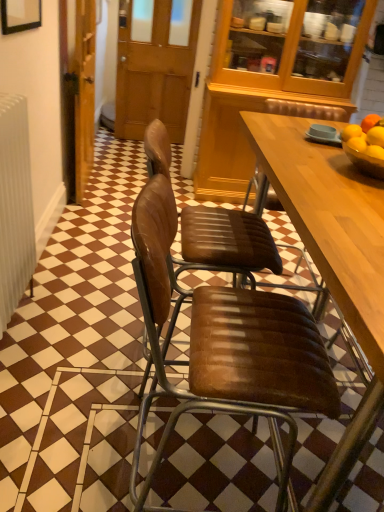
The width and height of the screenshot is (384, 512). Describe the element at coordinates (154, 75) in the screenshot. I see `brown wooden door at center` at that location.

This screenshot has height=512, width=384. What do you see at coordinates (228, 347) in the screenshot?
I see `brown leather chair at center, the 1th chair positioned from the bottom` at bounding box center [228, 347].

Consider the image. In order to face wooden door at left, should I rotate leftwards or rightwards?

Turn left by 14.219 degrees to look at wooden door at left.

This screenshot has width=384, height=512. I want to click on yellow matte/orange matte/orange bowl at right, so tap(366, 136).

Which chair is the 2nd one when counting from the right side of the brown wooden door at center? Please provide its 2D coordinates.

[(232, 246)]

Which is behind, brown leather chair at center, arranged as the 2th chair when ordered from the bottom, or brown wooden door at center?

brown wooden door at center is behind.

From the image's perspective, is brown leather chair at center, arranged as the 2th chair when ordered from the bottom, on top of brown wooden door at center?

Incorrect, from the image's perspective, brown leather chair at center, arranged as the 2th chair when ordered from the bottom, is lower than brown wooden door at center.

In terms of size, does brown leather chair at center, positioned as the second chair in top-to-bottom order, appear bigger or smaller than brown wooden door at center?

Considering their sizes, brown leather chair at center, positioned as the second chair in top-to-bottom order, takes up more space than brown wooden door at center.

Does brown leather chair at center, positioned as the second chair in top-to-bottom order, appear on the left side of brown wooden door at center?

No.

Consider the image. Would you say brown leather chair at center, the 1th chair positioned from the bottom, is inside or outside brown wooden door at center?

brown leather chair at center, the 1th chair positioned from the bottom, is outside brown wooden door at center.

Which object is wider, brown leather chair at center, the first chair when ordered from top to bottom, or brown leather chair at center, positioned as the second chair in top-to-bottom order?

With larger width is brown leather chair at center, the first chair when ordered from top to bottom.

From the image's perspective, is brown leather chair at center, the first chair when ordered from top to bottom, over brown leather chair at center, the 1th chair positioned from the bottom?

Yes, from the image's perspective, brown leather chair at center, the first chair when ordered from top to bottom, is above brown leather chair at center, the 1th chair positioned from the bottom.

Does brown leather chair at center, arranged as the 2th chair when ordered from the bottom, have a larger size compared to brown leather chair at center, positioned as the second chair in top-to-bottom order?

Incorrect, brown leather chair at center, arranged as the 2th chair when ordered from the bottom, is not larger than brown leather chair at center, positioned as the second chair in top-to-bottom order.

Is brown leather chair at center, the first chair when ordered from top to bottom, smaller than wooden door at left?

Correct, brown leather chair at center, the first chair when ordered from top to bottom, occupies less space than wooden door at left.

Could you tell me if brown leather chair at center, the first chair when ordered from top to bottom, is facing wooden door at left?

No, brown leather chair at center, the first chair when ordered from top to bottom, is not turned towards wooden door at left.

You are a GUI agent. You are given a task and a screenshot of the screen. Output one action in this format:
    pyautogui.click(x=<x>, y=<y>)
    Task: Click on the door that appears above the brown leather chair at center, arranged as the 2th chair when ordered from the bottom (from the image's perspective)
    The image size is (384, 512).
    Given the screenshot: What is the action you would take?
    pyautogui.click(x=84, y=93)

From the image's perspective, is brown wooden door at center below brown leather chair at center, positioned as the second chair in top-to-bottom order?

No.

From a real-world perspective, is brown wooden door at center physically below brown leather chair at center, the 1th chair positioned from the bottom?

No, from a real-world perspective, brown wooden door at center is not beneath brown leather chair at center, the 1th chair positioned from the bottom.

Can you confirm if brown wooden door at center is positioned to the left of brown leather chair at center, positioned as the second chair in top-to-bottom order?

Yes.

Can you tell me how much wooden door at left and brown wooden door at center differ in facing direction?

There is a 92.3-degree angle between the facing directions of wooden door at left and brown wooden door at center.

Is wooden door at left positioned beyond the bounds of brown wooden door at center?

Yes, wooden door at left is not within brown wooden door at center.

Does wooden door at left turn towards brown wooden door at center?

Yes.

You are a GUI agent. You are given a task and a screenshot of the screen. Output one action in this format:
    pyautogui.click(x=<x>, y=<y>)
    Task: Click on the door below the brown wooden door at center (from the image's perspective)
    Image resolution: width=384 pixels, height=512 pixels.
    Given the screenshot: What is the action you would take?
    click(84, 93)

Identify the location of the 1st chair below the brown wooden door at center (from the image's perspective). This screenshot has height=512, width=384. (232, 246).

From the image's perspective, relative to brown leather chair at center, the first chair when ordered from top to bottom, is brown wooden door at center above or below?

brown wooden door at center is above brown leather chair at center, the first chair when ordered from top to bottom.

Is brown wooden door at center aimed at brown leather chair at center, the first chair when ordered from top to bottom?

Yes, brown wooden door at center is turned towards brown leather chair at center, the first chair when ordered from top to bottom.

How different are the orientations of brown wooden door at center and brown leather chair at center, the first chair when ordered from top to bottom, in degrees?

The angular difference between brown wooden door at center and brown leather chair at center, the first chair when ordered from top to bottom, is 88.5 degrees.

Find the location of a particular element. glass door on the left side of brown leather chair at center, arranged as the 2th chair when ordered from the bottom is located at coordinates (154, 75).

The width and height of the screenshot is (384, 512). I want to click on glass door lying behind the brown leather chair at center, the 1th chair positioned from the bottom, so click(154, 75).

Looking at the image, which one is located closer to wooden door at left, brown leather chair at center, the first chair when ordered from top to bottom, or brown leather chair at center, positioned as the second chair in top-to-bottom order?

brown leather chair at center, the first chair when ordered from top to bottom, lies closer to wooden door at left than the other object.

When comparing their distances from brown leather chair at center, positioned as the second chair in top-to-bottom order, does yellow matte/orange matte/orange bowl at right or brown wooden door at center seem further?

brown wooden door at center lies further to brown leather chair at center, positioned as the second chair in top-to-bottom order, than the other object.

Which object lies further to the anchor point brown leather chair at center, the 1th chair positioned from the bottom, brown wooden door at center or wooden door at left?

brown wooden door at center is further to brown leather chair at center, the 1th chair positioned from the bottom.

Based on their spatial positions, is wooden door at left or yellow matte/orange matte/orange bowl at right further from brown wooden door at center?

yellow matte/orange matte/orange bowl at right.

When comparing their distances from brown leather chair at center, the 1th chair positioned from the bottom, does brown wooden door at center or yellow matte/orange matte/orange bowl at right seem closer?

yellow matte/orange matte/orange bowl at right.

Looking at the image, which one is located further to yellow matte/orange matte/orange bowl at right, brown wooden door at center or wooden door at left?

brown wooden door at center.

Considering their positions, is brown leather chair at center, the 1th chair positioned from the bottom, positioned closer to wooden door at left than yellow matte/orange matte/orange bowl at right?

Among the two, yellow matte/orange matte/orange bowl at right is located nearer to wooden door at left.

Looking at the image, which one is located further to brown leather chair at center, the 1th chair positioned from the bottom, brown wooden door at center or brown leather chair at center, the first chair when ordered from top to bottom?

brown wooden door at center lies further to brown leather chair at center, the 1th chair positioned from the bottom, than the other object.

This screenshot has width=384, height=512. I want to click on fruit located between brown leather chair at center, positioned as the second chair in top-to-bottom order, and brown wooden door at center in the depth direction, so click(x=366, y=136).

The image size is (384, 512). I want to click on door positioned between brown leather chair at center, the 1th chair positioned from the bottom, and brown wooden door at center from near to far, so [x=84, y=93].

This screenshot has height=512, width=384. In order to click on fruit between brown leather chair at center, positioned as the second chair in top-to-bottom order, and wooden door at left in the front-back direction in this screenshot , I will do `click(366, 136)`.

Find the location of `door between brown leather chair at center, the first chair when ordered from top to bottom, and brown wooden door at center, along the z-axis`. door between brown leather chair at center, the first chair when ordered from top to bottom, and brown wooden door at center, along the z-axis is located at coordinates (84, 93).